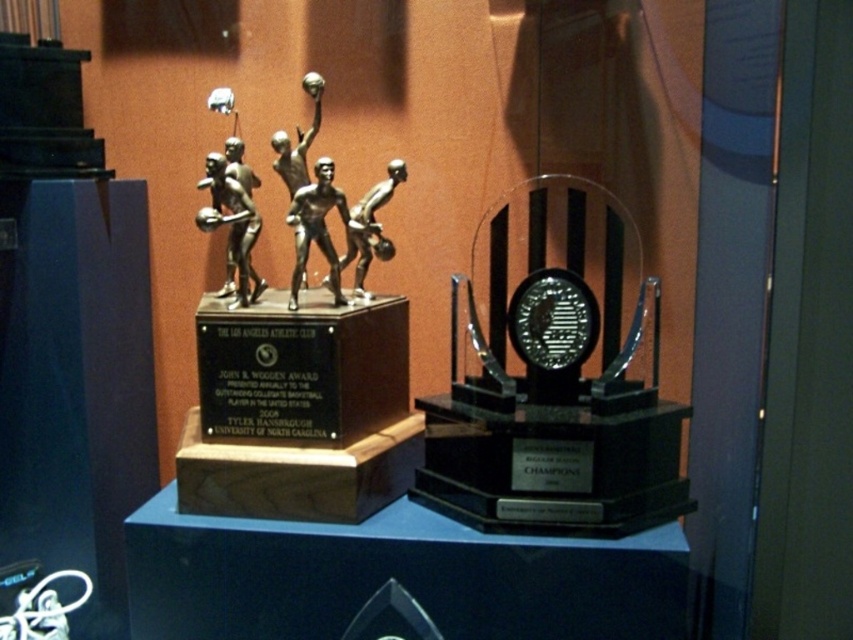
You are a tour guide standing 1.6 meters away from the glass case. You want to point out the bronze figure at center to your visitors. Can you reach it with your outstretched hand?

The bronze figure at center is 1.50 meters away from the viewer. Since you are standing 1.6 meters away from the glass case, your outstretched hand cannot reach it because the total distance would be more than 1.6 meters.

You are a museum security guard checking the dimensions of the trophies in the case. The bronze metallic basketball players at center and the silver metallic basketball players at center are both displayed. Which trophy is larger in size?

The bronze metallic basketball players at center is bigger than the silver metallic basketball players at center, so the bronze one is larger in size.